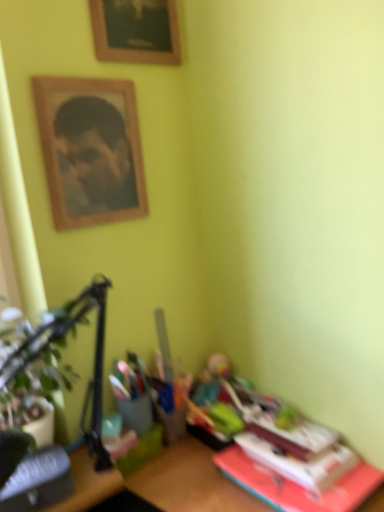
Question: Considering the relative sizes of green leafy plant at left and wooden picture frame at upper center in the image provided, is green leafy plant at left taller than wooden picture frame at upper center?

Choices:
 (A) yes
 (B) no

Answer: (A)

Question: Is wooden picture frame at upper center inside green leafy plant at left?

Choices:
 (A) no
 (B) yes

Answer: (A)

Question: Does green leafy plant at left have a lesser width compared to wooden picture frame at upper center?

Choices:
 (A) yes
 (B) no

Answer: (B)

Question: Considering the relative positions of green leafy plant at left and wooden picture frame at upper center in the image provided, is green leafy plant at left behind wooden picture frame at upper center?

Choices:
 (A) yes
 (B) no

Answer: (B)

Question: From the image's perspective, is green leafy plant at left below wooden picture frame at upper center?

Choices:
 (A) no
 (B) yes

Answer: (B)

Question: Considering the positions of hardcover book at lower right, which is counted as the second paperback book, starting from the left, and wooden framed portrait at upper left in the image, is hardcover book at lower right, which is counted as the second paperback book, starting from the left, wider or thinner than wooden framed portrait at upper left?

Choices:
 (A) wide
 (B) thin

Answer: (A)

Question: In the image, is hardcover book at lower right, the first paperback book in the right-to-left sequence, on the left side or the right side of wooden framed portrait at upper left?

Choices:
 (A) right
 (B) left

Answer: (A)

Question: Considering their positions, is hardcover book at lower right, the first paperback book in the right-to-left sequence, located in front of or behind wooden framed portrait at upper left?

Choices:
 (A) behind
 (B) front

Answer: (B)

Question: From a real-world perspective, is hardcover book at lower right, which is counted as the second paperback book, starting from the left, physically located above or below wooden framed portrait at upper left?

Choices:
 (A) below
 (B) above

Answer: (A)

Question: Considering the positions of hardcover book at lower left, which appears as the first paperback book when viewed from the left, and wooden framed portrait at upper left in the image, is hardcover book at lower left, which appears as the first paperback book when viewed from the left, wider or thinner than wooden framed portrait at upper left?

Choices:
 (A) thin
 (B) wide

Answer: (B)

Question: Is point (48, 482) closer or farther from the camera than point (82, 203)?

Choices:
 (A) closer
 (B) farther

Answer: (A)

Question: Looking at the image, does hardcover book at lower left, positioned as the 2th paperback book in right-to-left order, seem bigger or smaller compared to wooden framed portrait at upper left?

Choices:
 (A) big
 (B) small

Answer: (B)

Question: From the image's perspective, is hardcover book at lower left, positioned as the 2th paperback book in right-to-left order, positioned above or below wooden framed portrait at upper left?

Choices:
 (A) below
 (B) above

Answer: (A)

Question: Is point (31, 357) closer or farther from the camera than point (321, 481)?

Choices:
 (A) farther
 (B) closer

Answer: (B)

Question: From the image's perspective, is green leafy plant at left located above or below hardcover book at lower right, which is counted as the second paperback book, starting from the left?

Choices:
 (A) below
 (B) above

Answer: (B)